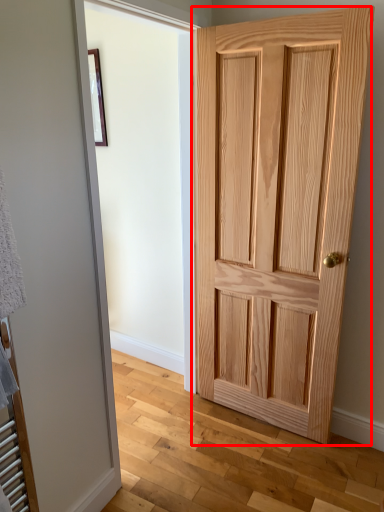
Question: From the image's perspective, what is the correct spatial positioning of door (annotated by the red box) in reference to picture frame?

Choices:
 (A) below
 (B) above

Answer: (A)